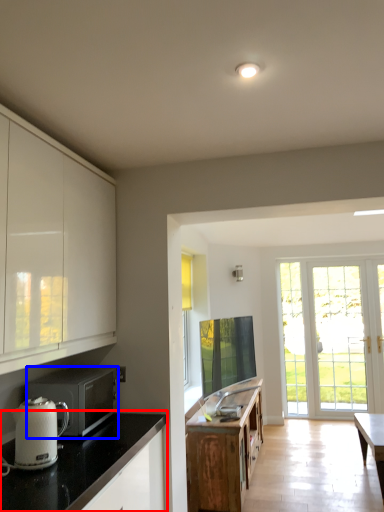
Question: Which point is closer to the camera, countertop (highlighted by a red box) or microwave oven (highlighted by a blue box)?

Choices:
 (A) countertop
 (B) microwave oven

Answer: (A)